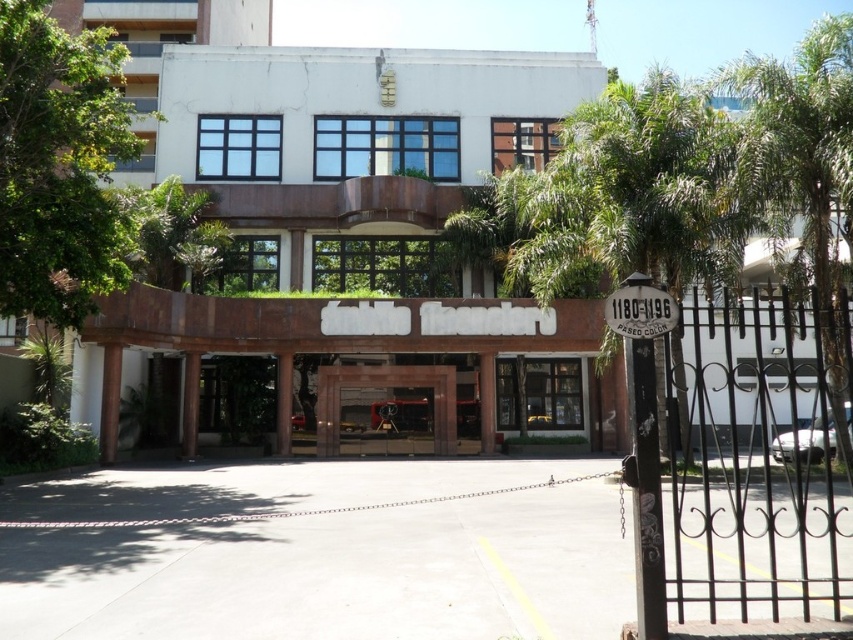
In the scene shown: Who is more distant from viewer, (x=212, y=16) or (x=451, y=451)?

Positioned behind is point (x=212, y=16).

Does clear glass window at upper center appear on the left side of brown stone gate at center?

Yes, clear glass window at upper center is to the left of brown stone gate at center.

Between point (193, 17) and point (451, 381), which one is positioned behind?

Point (193, 17)

Where is `clear glass window at upper center`? The width and height of the screenshot is (853, 640). clear glass window at upper center is located at coordinates (167, 29).

Is point (192, 20) less distant than point (506, 424)?

No.

Can you confirm if clear glass window at upper center is positioned below clear glass door at center?

Actually, clear glass window at upper center is above clear glass door at center.

Locate an element on the screen. Image resolution: width=853 pixels, height=640 pixels. clear glass window at upper center is located at coordinates point(167,29).

Find the location of a particular element. Image resolution: width=853 pixels, height=640 pixels. clear glass window at upper center is located at coordinates coord(167,29).

Is green leafy tree at left above clear glass window at upper center?

Incorrect, green leafy tree at left is not positioned above clear glass window at upper center.

Who is more distant from viewer, (15, 172) or (91, 16)?

The point (91, 16) is behind.

Where is `green leafy tree at left`? This screenshot has width=853, height=640. green leafy tree at left is located at coordinates (61, 164).